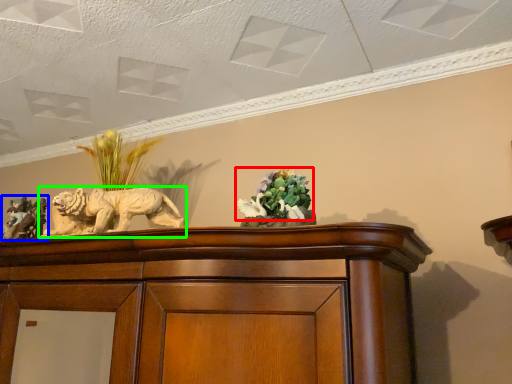
Question: Based on their relative distances, which object is farther from flower (highlighted by a red box)? Choose from sculpture (highlighted by a blue box) and lion (highlighted by a green box).

Choices:
 (A) sculpture
 (B) lion

Answer: (A)